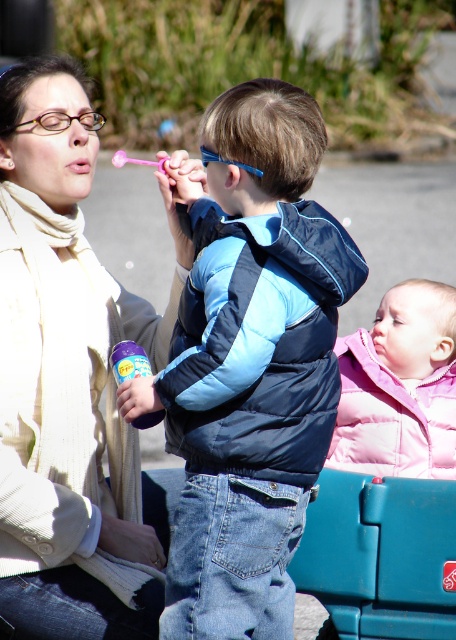
Question: Which of the following is the farthest from the observer?

Choices:
 (A) (217, 342)
 (B) (171, 445)
 (C) (57, 429)

Answer: (C)

Question: From the image, what is the correct spatial relationship of matte beige scarf at upper left in relation to blue synthetic puffer jacket at center?

Choices:
 (A) above
 (B) below

Answer: (B)

Question: Which object is positioned farthest from the pink puffy jacket at lower right?

Choices:
 (A) matte beige scarf at upper left
 (B) blue down jacket at center
 (C) blue synthetic puffer jacket at center

Answer: (C)

Question: Among these objects, which one is nearest to the camera?

Choices:
 (A) blue down jacket at center
 (B) pink puffy jacket at lower right
 (C) blue synthetic puffer jacket at center
 (D) matte beige scarf at upper left

Answer: (C)

Question: Is blue down jacket at center above blue synthetic puffer jacket at center?

Choices:
 (A) yes
 (B) no

Answer: (B)

Question: Where is matte beige scarf at upper left located in relation to pink puffy jacket at lower right in the image?

Choices:
 (A) right
 (B) left

Answer: (B)